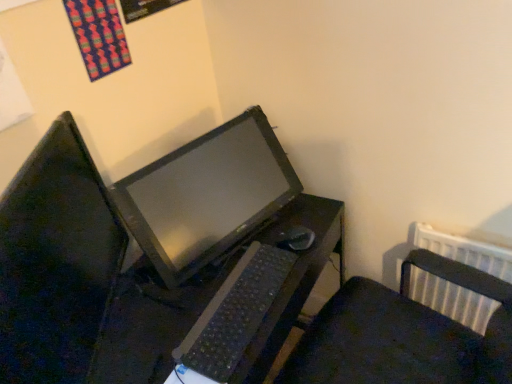
Where is `free space that is to the left of black plastic keyboard at center`? The height and width of the screenshot is (384, 512). free space that is to the left of black plastic keyboard at center is located at coordinates (156, 309).